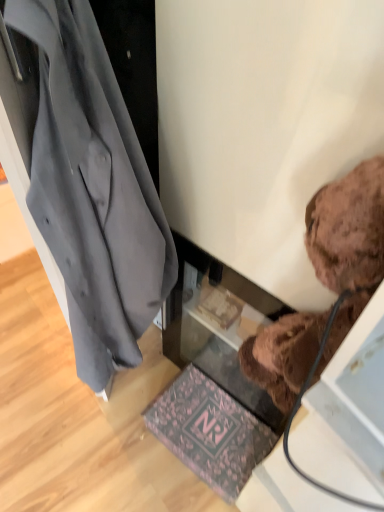
Question: From a real-world perspective, is dark gray fabric coat at left positioned above or below pink floral mat at lower center?

Choices:
 (A) below
 (B) above

Answer: (B)

Question: Looking at the image, does dark gray fabric coat at left seem bigger or smaller compared to pink floral mat at lower center?

Choices:
 (A) big
 (B) small

Answer: (A)

Question: Which is nearer to the pink floral mat at lower center?

Choices:
 (A) brown plush teddy bear at upper right
 (B) dark gray fabric coat at left

Answer: (B)

Question: Estimate the real-world distances between objects in this image. Which object is farther from the dark gray fabric coat at left?

Choices:
 (A) pink floral mat at lower center
 (B) brown plush teddy bear at upper right

Answer: (A)